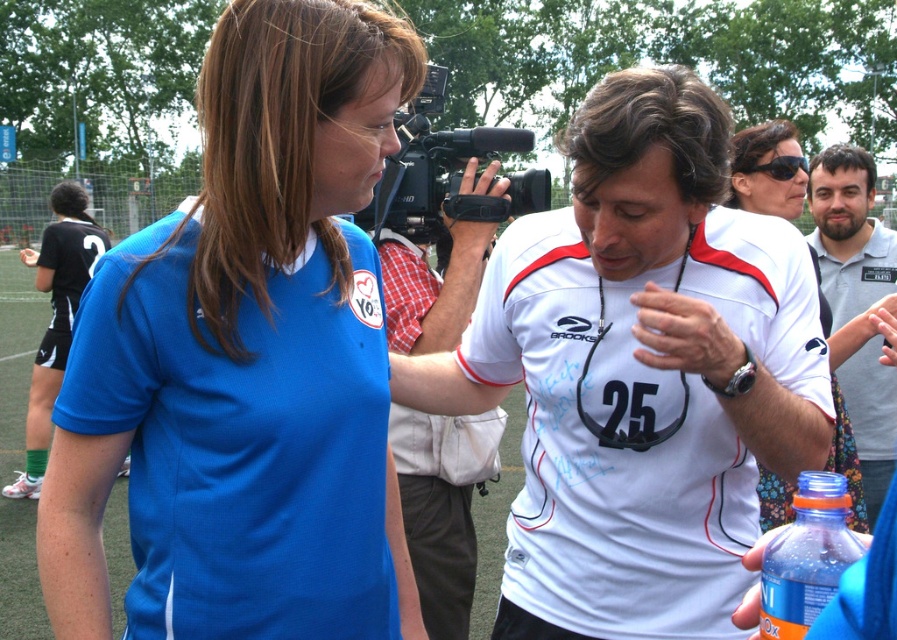
You are a photographer at the soccer field and want to capture both the black plastic video camera at center and the translucent plastic bottle at lower right in your shot. Which object should you focus on first to ensure both are in frame?

The black plastic video camera at center is positioned over the translucent plastic bottle at lower right, so focusing on the camera first will ensure the bottle is still in frame below it.

You are a photographer at the sports event and want to capture both the matte blue jersey at center and the white fabric shirt at center in a single shot. Which object should be placed closer to the camera to ensure both are fully visible in the frame?

The matte blue jersey at center has a greater height compared to the white fabric shirt at center, so placing the matte blue jersey at center closer to the camera will help ensure both are fully visible in the frame.